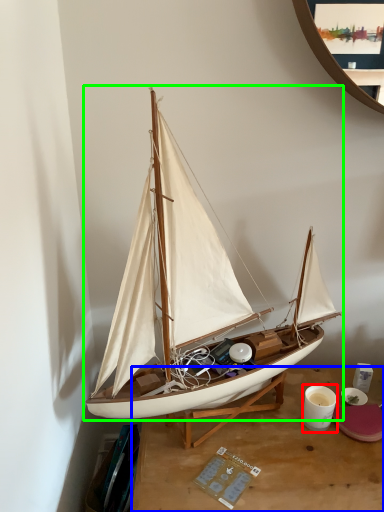
Question: Which is farther away from coffee cup (highlighted by a red box)? desk (highlighted by a blue box) or boat (highlighted by a green box)?

Choices:
 (A) desk
 (B) boat

Answer: (B)